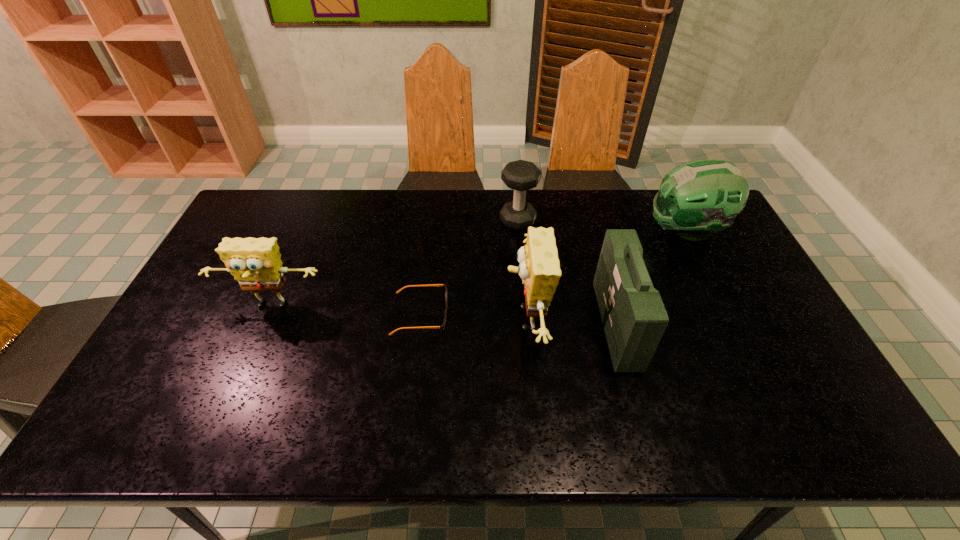
The height and width of the screenshot is (540, 960). What are the coordinates of `vacant area at the right edge` in the screenshot? It's located at (749, 281).

Locate an element on the screen. free spot between the shortest object and the second object from right to left is located at coordinates (518, 319).

The height and width of the screenshot is (540, 960). Identify the location of free space that is in between the first-aid kit and the taller sponge. (571, 322).

Locate an element on the screen. vacant region between the taller sponge and the shortest object is located at coordinates (473, 317).

Find the location of a particular element. Image resolution: width=960 pixels, height=540 pixels. empty location between the shorter sponge and the rightmost object is located at coordinates (479, 268).

At what (x,y) coordinates should I click in order to perform the action: click on vacant region between the left sponge and the second object from left to right. Please return your answer as a coordinate pair (x, y). Image resolution: width=960 pixels, height=540 pixels. Looking at the image, I should click on pyautogui.click(x=347, y=310).

At what (x,y) coordinates should I click in order to perform the action: click on unoccupied position between the shorter sponge and the spectacles. Please return your answer as a coordinate pair (x, y). The height and width of the screenshot is (540, 960). Looking at the image, I should click on (347, 310).

Find the location of `free area in between the shorter sponge and the spectacles`. free area in between the shorter sponge and the spectacles is located at coordinates (347, 310).

Image resolution: width=960 pixels, height=540 pixels. I want to click on free area in between the leftmost object and the rightmost object, so click(x=479, y=268).

Locate which object is the second closest to the right sponge. Please provide its 2D coordinates. Your answer should be formatted as a tuple, i.e. [(x, y)], where the tuple contains the x and y coordinates of a point satisfying the conditions above.

[(442, 327)]